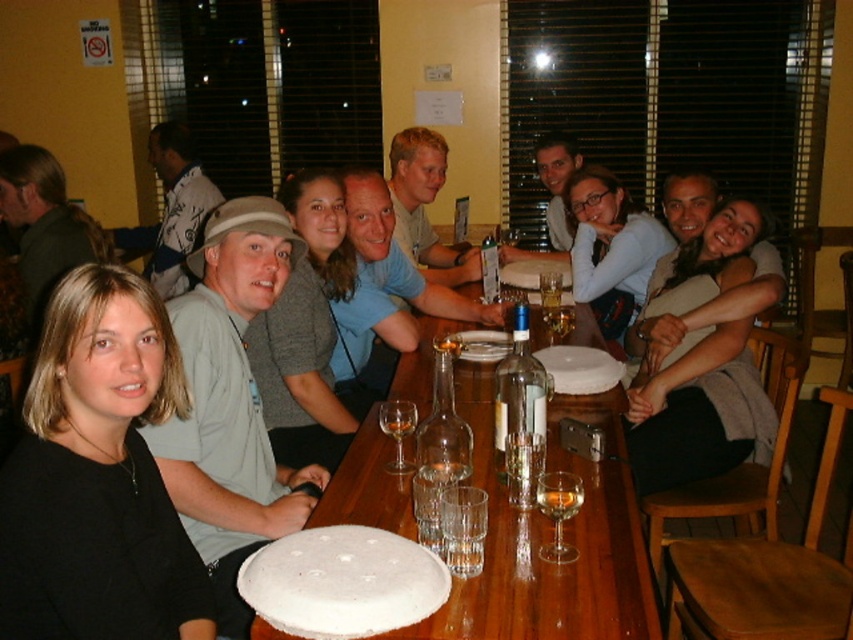
You are a server at a restaurant and need to place a new order of drinks on the table. The drinks are in a tray, and you want to ensure there is enough space between the light brown sweater at center and the clear glass at table center. Can you determine if there is enough space to place the drinks without moving either object?

The light brown sweater at center has a larger size compared to clear glass at table center. Since the sweater is larger, there might be sufficient space around it to place the drinks without disturbing either object, provided the tray fits within the available area.

You are a bartender preparing a drink for a customer wearing a light brown sweater at center. The customer is seated at the table center. You have a clear glass at table center. To ensure the drink is served properly, which object should you prioritize placing the drink into, considering their sizes?

The light brown sweater at center is much taller than the clear glass at table center, so you should prioritize placing the drink into the clear glass at table center since it is the appropriate container for holding liquids.